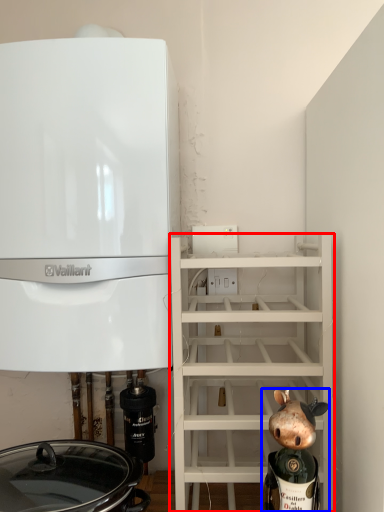
Question: Which of the following is the farthest to the observer, shelf (highlighted by a red box) or figurine (highlighted by a blue box)?

Choices:
 (A) shelf
 (B) figurine

Answer: (A)